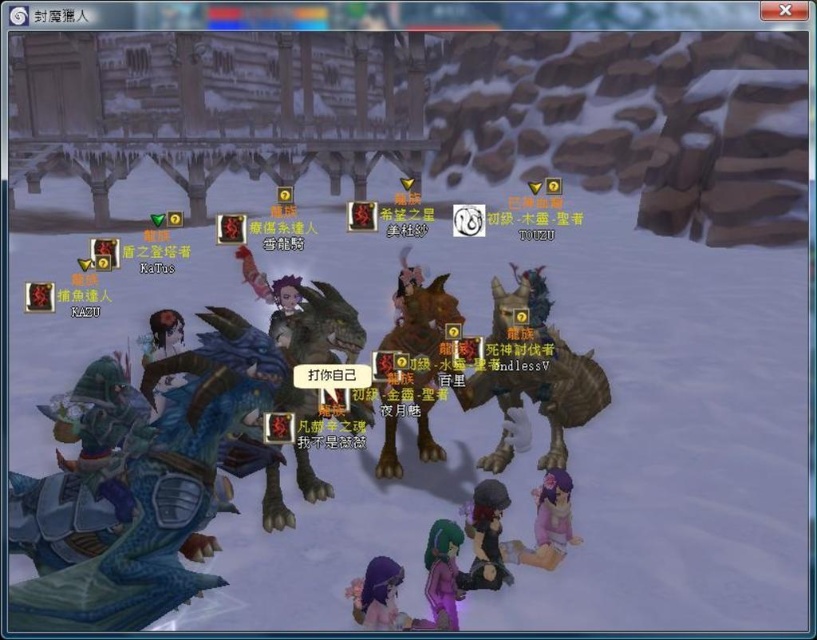
You are a player in this MMORPG scene. You need to locate the blue metallic dragon at left. According to the game map, the dragon is at coordinates 0.764 on the x axis and 0.200 on the y axis. If you are currently at the center of the map, which direction should you move to reach the dragon?

The blue metallic dragon at left is located at coordinates x 0.764 and y 0.200. Since you are at the center, moving northeast will bring you closer to the dragon.